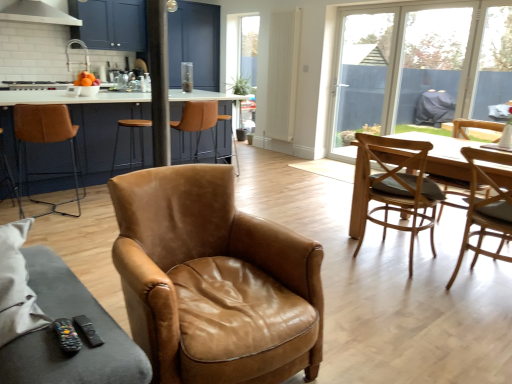
The image size is (512, 384). Identify the location of free location to the right of brown leather armchair at center, acting as the 4th chair starting from the right. (381, 333).